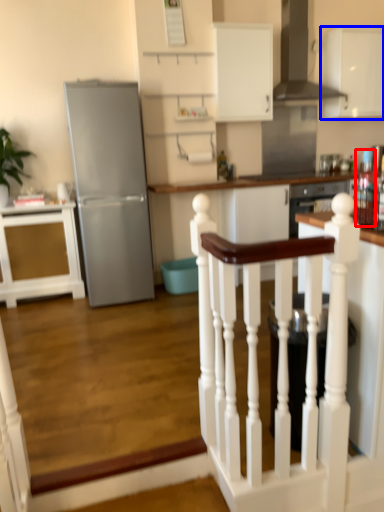
Question: Which object appears closest to the camera in this image, appliance (highlighted by a red box) or cabinetry (highlighted by a blue box)?

Choices:
 (A) appliance
 (B) cabinetry

Answer: (A)